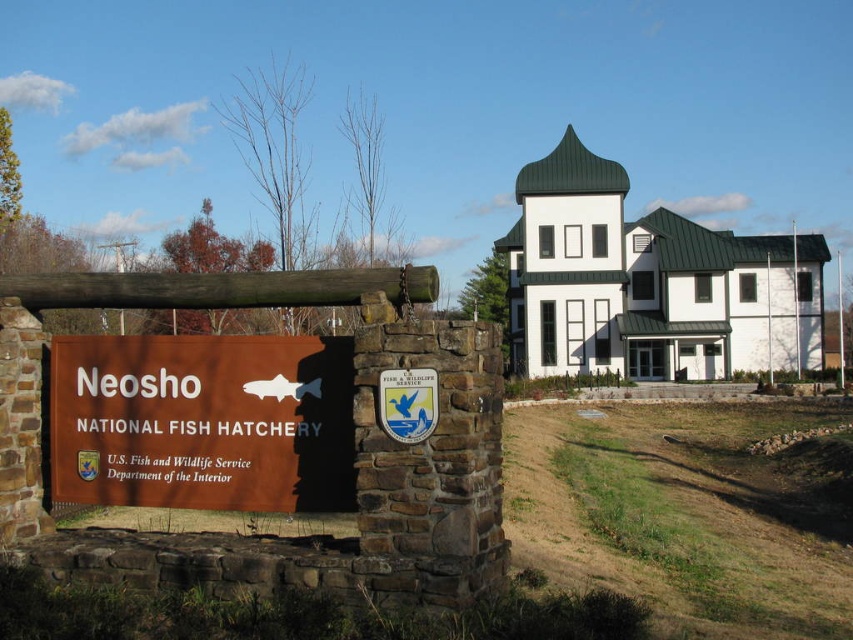
You are standing at the entrance of the Neosho National Fish Hatchery. There is a point marked at coordinates (202, 420). What object is located at this point?

The brown matte sign at center is located at point (202, 420).

You are standing at the entrance of the Neosho National Fish Hatchery and want to take a photo of the brown matte sign at center. If your camera can focus on objects up to 20 feet away, will you be able to capture the sign clearly?

The brown matte sign at center is 19.51 feet away from the camera, which is within the camera focus range of up to 20 feet. Therefore, you can capture the sign clearly.